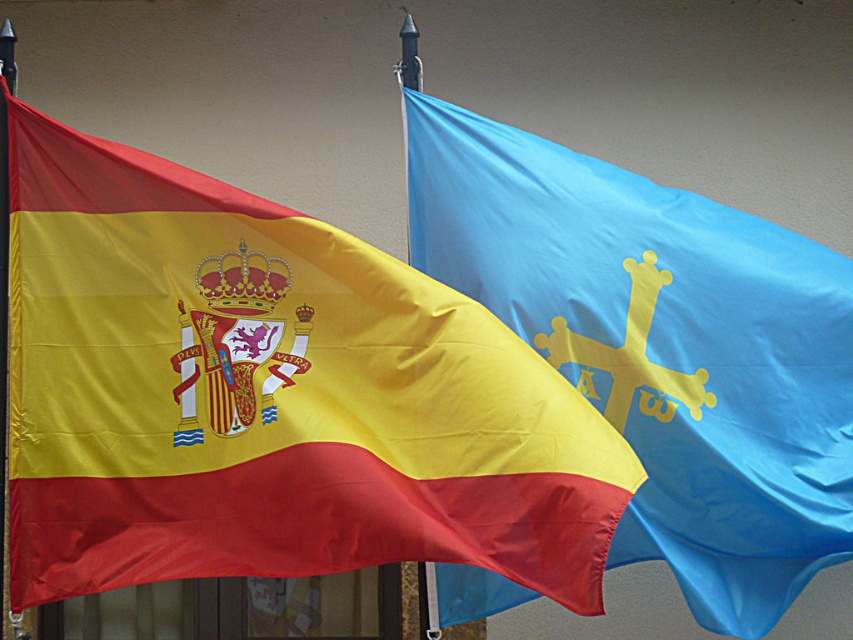
Who is lower down, matte blue flag with yellow cross at right or metallic pole at left?

Positioned lower is matte blue flag with yellow cross at right.

What do you see at coordinates (660, 348) in the screenshot? I see `matte blue flag with yellow cross at right` at bounding box center [660, 348].

The image size is (853, 640). In order to click on matte blue flag with yellow cross at right in this screenshot , I will do `click(660, 348)`.

Which is in front, point (317, 483) or point (682, 376)?

Positioned in front is point (317, 483).

Looking at this image, who is taller, matte fabric flag at left or matte blue flag with yellow cross at right?

matte blue flag with yellow cross at right is taller.

This screenshot has height=640, width=853. I want to click on matte fabric flag at left, so click(x=268, y=396).

From the picture: Can you confirm if matte fabric flag at left is positioned to the left of metallic pole at left?

No, matte fabric flag at left is not to the left of metallic pole at left.

Which is more to the right, matte fabric flag at left or metallic pole at left?

Positioned to the right is matte fabric flag at left.

Between point (115, 454) and point (4, 353), which one is positioned behind?

The point (4, 353) is behind.

Locate an element on the screen. The width and height of the screenshot is (853, 640). matte fabric flag at left is located at coordinates (268, 396).